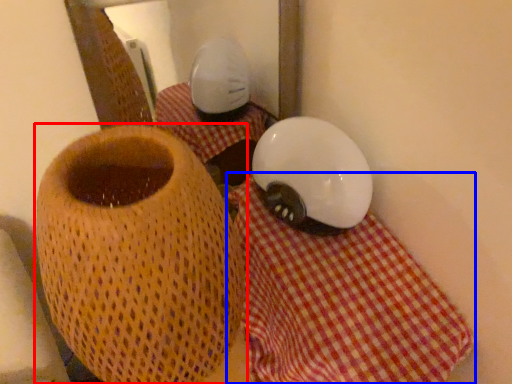
Question: Which of the following is the closest to the observer, vase (highlighted by a red box) or tablecloth (highlighted by a blue box)?

Choices:
 (A) vase
 (B) tablecloth

Answer: (A)